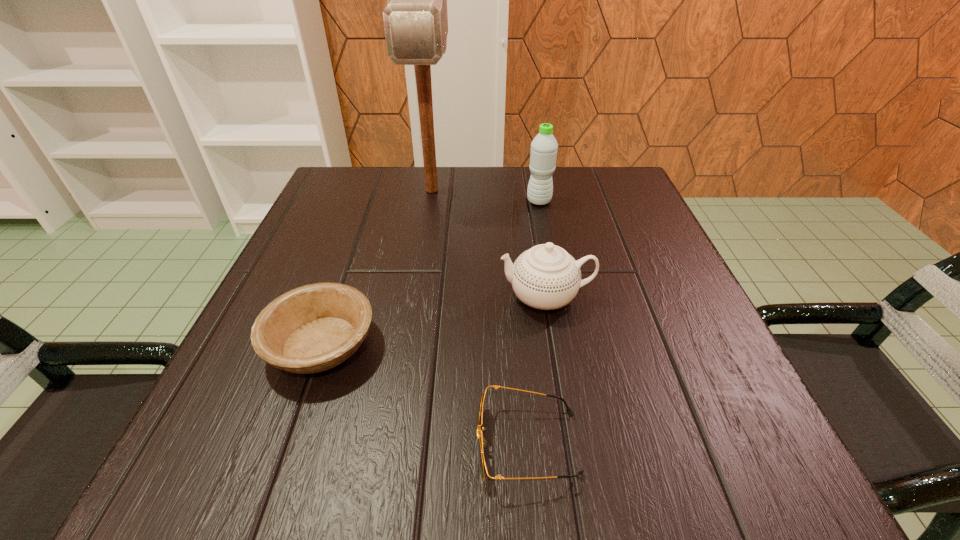
Image resolution: width=960 pixels, height=540 pixels. I want to click on free point located on the spout of the third tallest object, so click(x=396, y=297).

At what (x,y) coordinates should I click in order to perform the action: click on vacant space situated on the spout of the third tallest object. Please return your answer as a coordinate pair (x, y). The height and width of the screenshot is (540, 960). Looking at the image, I should click on (350, 297).

Where is `free space located 0.080m on the spout of the third tallest object`? The image size is (960, 540). free space located 0.080m on the spout of the third tallest object is located at coordinates (454, 297).

You are a GUI agent. You are given a task and a screenshot of the screen. Output one action in this format:
    pyautogui.click(x=<x>, y=<y>)
    Task: Click on the vacant space located 0.140m on the right of the second shortest object
    
    Given the screenshot: What is the action you would take?
    pyautogui.click(x=467, y=345)

The width and height of the screenshot is (960, 540). I want to click on free space located 0.370m on the lenses of the sunglasses, so click(x=188, y=444).

At what (x,y) coordinates should I click in order to perform the action: click on free location located on the lenses of the sunglasses. Please return your answer as a coordinate pair (x, y). Looking at the image, I should click on (275, 444).

The width and height of the screenshot is (960, 540). In order to click on vacant space positioned on the lenses of the sunglasses in this screenshot , I will do `click(337, 444)`.

Where is `mallet at the far edge`? Image resolution: width=960 pixels, height=540 pixels. mallet at the far edge is located at coordinates (415, 20).

The width and height of the screenshot is (960, 540). What are the coordinates of `water bottle at the far edge` in the screenshot? It's located at (544, 146).

Locate an element on the screen. The height and width of the screenshot is (540, 960). object that is at the near edge is located at coordinates (482, 443).